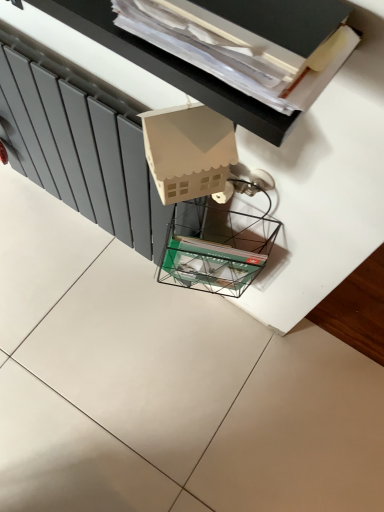
Question: Can you confirm if matte gray radiator at left is taller than matte cardboard house at upper center?

Choices:
 (A) no
 (B) yes

Answer: (B)

Question: Are matte gray radiator at left and matte cardboard house at upper center making contact?

Choices:
 (A) no
 (B) yes

Answer: (A)

Question: Does matte gray radiator at left contain matte cardboard house at upper center?

Choices:
 (A) no
 (B) yes

Answer: (A)

Question: Is matte gray radiator at left wider than matte cardboard house at upper center?

Choices:
 (A) yes
 (B) no

Answer: (B)

Question: From a real-world perspective, does matte gray radiator at left sit lower than matte cardboard house at upper center?

Choices:
 (A) yes
 (B) no

Answer: (A)

Question: From the image's perspective, is matte gray radiator at left located above matte cardboard house at upper center?

Choices:
 (A) no
 (B) yes

Answer: (A)

Question: Considering the relative sizes of clear glass magazine rack at center and matte cardboard house at upper center in the image provided, is clear glass magazine rack at center wider than matte cardboard house at upper center?

Choices:
 (A) yes
 (B) no

Answer: (B)

Question: Could you tell me if clear glass magazine rack at center is facing matte cardboard house at upper center?

Choices:
 (A) no
 (B) yes

Answer: (A)

Question: Is clear glass magazine rack at center to the left of matte cardboard house at upper center from the viewer's perspective?

Choices:
 (A) no
 (B) yes

Answer: (A)

Question: From the image's perspective, is clear glass magazine rack at center on matte cardboard house at upper center?

Choices:
 (A) yes
 (B) no

Answer: (B)

Question: From a real-world perspective, is clear glass magazine rack at center positioned over matte cardboard house at upper center based on gravity?

Choices:
 (A) no
 (B) yes

Answer: (A)

Question: Can you confirm if clear glass magazine rack at center is thinner than matte cardboard house at upper center?

Choices:
 (A) yes
 (B) no

Answer: (A)

Question: Does matte cardboard house at upper center turn towards matte gray radiator at left?

Choices:
 (A) no
 (B) yes

Answer: (A)